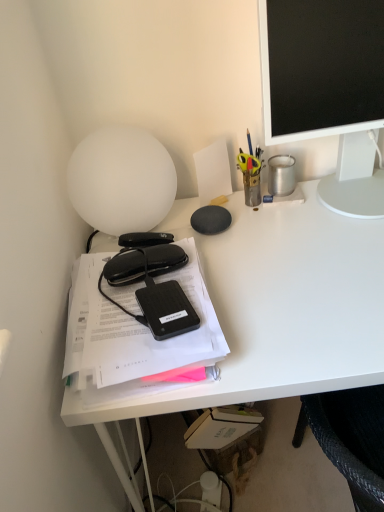
Question: Can you confirm if black plastic external hard drive at center is positioned to the right of black matte glasses case at left, marked as the first stationery in a left-to-right arrangement?

Choices:
 (A) yes
 (B) no

Answer: (A)

Question: Is black plastic external hard drive at center bigger than black matte glasses case at left, the 3th stationery in the top-to-bottom sequence?

Choices:
 (A) no
 (B) yes

Answer: (A)

Question: From a real-world perspective, is black plastic external hard drive at center positioned under black matte glasses case at left, marked as the first stationery in a left-to-right arrangement, based on gravity?

Choices:
 (A) yes
 (B) no

Answer: (A)

Question: From the image's perspective, is black plastic external hard drive at center located above black matte glasses case at left, the 3th stationery in the top-to-bottom sequence?

Choices:
 (A) no
 (B) yes

Answer: (A)

Question: Is black plastic external hard drive at center positioned with its back to black matte glasses case at left, marked as the first stationery in a left-to-right arrangement?

Choices:
 (A) yes
 (B) no

Answer: (A)

Question: Does black plastic external hard drive at center turn towards black matte glasses case at left, marked as the first stationery in a left-to-right arrangement?

Choices:
 (A) yes
 (B) no

Answer: (B)

Question: From the image's perspective, would you say matte black monitor at upper right is shown under white matte desk at left?

Choices:
 (A) yes
 (B) no

Answer: (B)

Question: From a real-world perspective, is matte black monitor at upper right positioned over white matte desk at left based on gravity?

Choices:
 (A) no
 (B) yes

Answer: (B)

Question: Does matte black monitor at upper right have a larger size compared to white matte desk at left?

Choices:
 (A) no
 (B) yes

Answer: (A)

Question: Is matte black monitor at upper right facing towards white matte desk at left?

Choices:
 (A) yes
 (B) no

Answer: (B)

Question: Does matte black monitor at upper right come in front of white matte desk at left?

Choices:
 (A) no
 (B) yes

Answer: (A)

Question: Would you say matte black monitor at upper right contains white matte desk at left?

Choices:
 (A) no
 (B) yes

Answer: (A)

Question: Does black matte hardcover at left have a larger size compared to metallic pen holder at upper right, the 3th stationery ordered from the bottom?

Choices:
 (A) yes
 (B) no

Answer: (A)